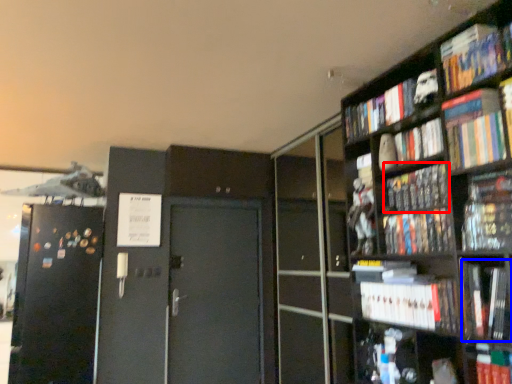
Question: Which object appears closest to the camera in this image, book (highlighted by a red box) or book (highlighted by a blue box)?

Choices:
 (A) book
 (B) book

Answer: (B)